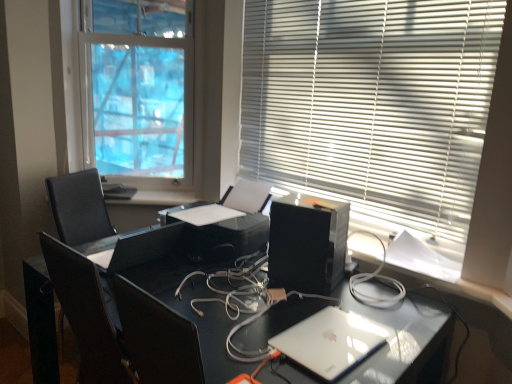
Question: Is white glossy window sill at center taller or shorter than black plastic printer at center?

Choices:
 (A) tall
 (B) short

Answer: (B)

Question: Visually, is white glossy window sill at center positioned to the left or to the right of black plastic printer at center?

Choices:
 (A) right
 (B) left

Answer: (B)

Question: Which of these objects is positioned closest to the satin white laptop at lower right?

Choices:
 (A) white blinds at upper right, the first window blind positioned from the left
 (B) satin black desk at center
 (C) white glossy window sill at center
 (D) matte black monitor at center
 (E) black plastic printer at center

Answer: (B)

Question: Which is nearer to the black plastic desktop computer at center?

Choices:
 (A) satin black desk at center
 (B) matte black monitor at center
 (C) white plastic blinds at upper right, the 2th window blind from the back
 (D) black plastic printer at center
 (E) white glossy window sill at center

Answer: (D)